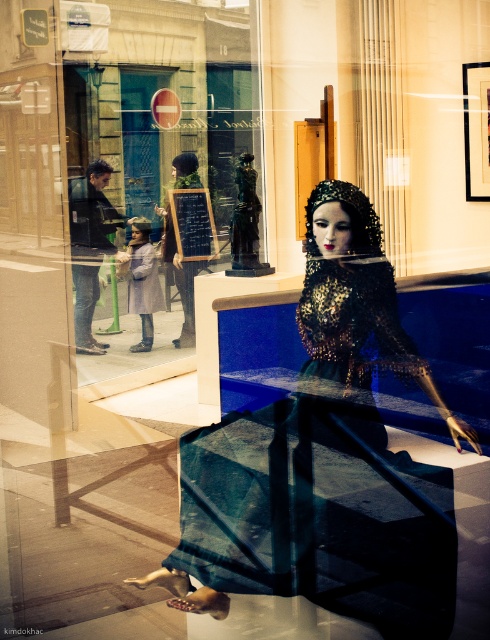
Question: Which point is closer to the camera?

Choices:
 (A) (413, 586)
 (B) (248, 125)

Answer: (A)

Question: Is shiny sequined dress at center to the left of matte black dress at center from the viewer's perspective?

Choices:
 (A) yes
 (B) no

Answer: (B)

Question: Does shiny sequined dress at center have a larger size compared to matte black dress at center?

Choices:
 (A) yes
 (B) no

Answer: (B)

Question: Among these objects, which one is farthest from the camera?

Choices:
 (A) matte black dress at center
 (B) shiny sequined dress at center

Answer: (A)

Question: Does shiny sequined dress at center appear on the left side of matte black dress at center?

Choices:
 (A) no
 (B) yes

Answer: (A)